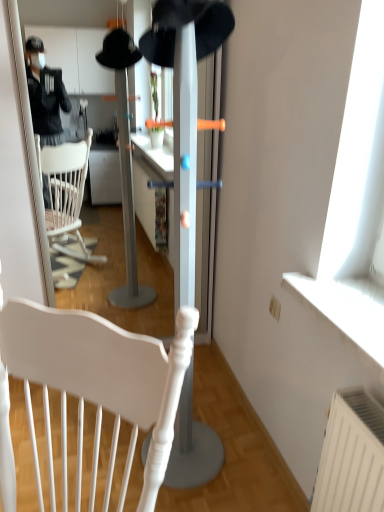
Question: Does point (153, 11) appear closer or farther from the camera than point (38, 306)?

Choices:
 (A) closer
 (B) farther

Answer: (B)

Question: In terms of size, does black felt hat at center appear bigger or smaller than white matte chair at center?

Choices:
 (A) big
 (B) small

Answer: (B)

Question: Based on their positions, is black felt hat at center located to the left or right of white matte chair at center?

Choices:
 (A) left
 (B) right

Answer: (B)

Question: Is white matte chair at center to the left or to the right of black felt hat at center in the image?

Choices:
 (A) right
 (B) left

Answer: (B)

Question: Is white matte chair at center bigger or smaller than black felt hat at center?

Choices:
 (A) big
 (B) small

Answer: (A)

Question: Looking at their shapes, would you say white matte chair at center is wider or thinner than black felt hat at center?

Choices:
 (A) wide
 (B) thin

Answer: (A)

Question: From a real-world perspective, is white matte chair at center physically located above or below black felt hat at center?

Choices:
 (A) below
 (B) above

Answer: (A)